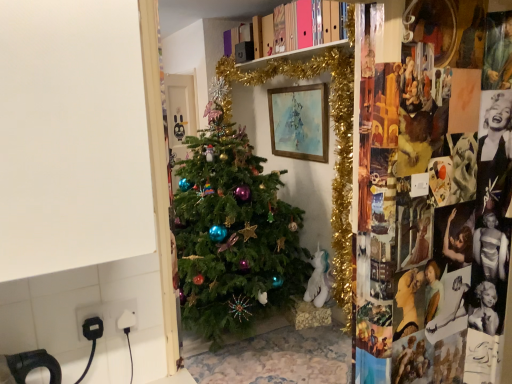
Measure the distance between watercolor paper painting at center and camera.

watercolor paper painting at center and camera are 2.89 meters apart.

Identify the location of watercolor paper painting at center. (298, 122).

What is the approximate width of watercolor paper painting at center?

watercolor paper painting at center is 6.65 centimeters wide.

This screenshot has width=512, height=384. Describe the element at coordinates (298, 122) in the screenshot. I see `watercolor paper painting at center` at that location.

Image resolution: width=512 pixels, height=384 pixels. What do you see at coordinates (126, 314) in the screenshot?
I see `white plastic plug at lower left` at bounding box center [126, 314].

Where is `white plastic plug at lower left`? white plastic plug at lower left is located at coordinates (126, 314).

What is the approximate height of white plastic plug at lower left?

It is 1.60 inches.

What are the coordinates of `watercolor paper painting at center` in the screenshot? It's located at (298, 122).

Can you confirm if white plastic plug at lower left is positioned to the left of watercolor paper painting at center?

Yes.

Does white plastic plug at lower left lie in front of watercolor paper painting at center?

Yes, it is in front of watercolor paper painting at center.

Considering the points (131, 314) and (301, 138), which point is behind, point (131, 314) or point (301, 138)?

Point (301, 138)

From the image's perspective, is white plastic plug at lower left on top of watercolor paper painting at center?

No, from the image's perspective, white plastic plug at lower left is not on top of watercolor paper painting at center.

From a real-world perspective, relative to watercolor paper painting at center, is white plastic plug at lower left vertically above or below?

Clearly, from a real-world perspective, white plastic plug at lower left is below watercolor paper painting at center.

Is white plastic plug at lower left wider or thinner than watercolor paper painting at center?

In the image, white plastic plug at lower left appears to be more narrow than watercolor paper painting at center.

From their relative heights in the image, would you say white plastic plug at lower left is taller or shorter than watercolor paper painting at center?

Clearly, white plastic plug at lower left is shorter compared to watercolor paper painting at center.

Considering the sizes of objects white plastic plug at lower left and watercolor paper painting at center in the image provided, who is bigger, white plastic plug at lower left or watercolor paper painting at center?

With larger size is watercolor paper painting at center.

Based on the photo, is white plastic plug at lower left positioned beyond the bounds of watercolor paper painting at center?

Yes, white plastic plug at lower left is outside of watercolor paper painting at center.

Is white plastic plug at lower left positioned far away from watercolor paper painting at center?

Yes, white plastic plug at lower left and watercolor paper painting at center are located far from each other.

Is white plastic plug at lower left positioned with its back to watercolor paper painting at center?

No.

Image resolution: width=512 pixels, height=384 pixels. I want to click on electric outlet that appears below the watercolor paper painting at center (from the image's perspective), so point(126,314).

Does watercolor paper painting at center appear on the right side of white plastic plug at lower left?

Correct, you'll find watercolor paper painting at center to the right of white plastic plug at lower left.

Relative to white plastic plug at lower left, is watercolor paper painting at center in front or behind?

Clearly, watercolor paper painting at center is behind white plastic plug at lower left.

Does point (328, 131) lie behind point (130, 327)?

Yes.

Looking at this image, from the image's perspective, is watercolor paper painting at center above or below white plastic plug at lower left?

From the image's perspective, watercolor paper painting at center appears above white plastic plug at lower left.

From a real-world perspective, is watercolor paper painting at center positioned under white plastic plug at lower left based on gravity?

Actually, watercolor paper painting at center is physically above white plastic plug at lower left in the real world.

Between watercolor paper painting at center and white plastic plug at lower left, which one has smaller width?

With smaller width is white plastic plug at lower left.

In terms of height, does watercolor paper painting at center look taller or shorter compared to white plastic plug at lower left?

In the image, watercolor paper painting at center appears to be taller than white plastic plug at lower left.

Based on their sizes in the image, would you say watercolor paper painting at center is bigger or smaller than white plastic plug at lower left?

Clearly, watercolor paper painting at center is larger in size than white plastic plug at lower left.

Would you say watercolor paper painting at center contains white plastic plug at lower left?

Definitely not — white plastic plug at lower left is not inside watercolor paper painting at center.

Is watercolor paper painting at center not near white plastic plug at lower left?

Yes.

Is watercolor paper painting at center oriented away from white plastic plug at lower left?

No.

Measure the distance between watercolor paper painting at center and white plastic plug at lower left.

2.46 meters.

This screenshot has height=384, width=512. Find the location of `electric outlet that appears in front of the watercolor paper painting at center`. electric outlet that appears in front of the watercolor paper painting at center is located at coordinates (126, 314).

Locate an element on the screen. The width and height of the screenshot is (512, 384). electric outlet on the left side of watercolor paper painting at center is located at coordinates (126, 314).

Where is `picture frame that appears above the white plastic plug at lower left (from a real-world perspective)`? The image size is (512, 384). picture frame that appears above the white plastic plug at lower left (from a real-world perspective) is located at coordinates (298, 122).